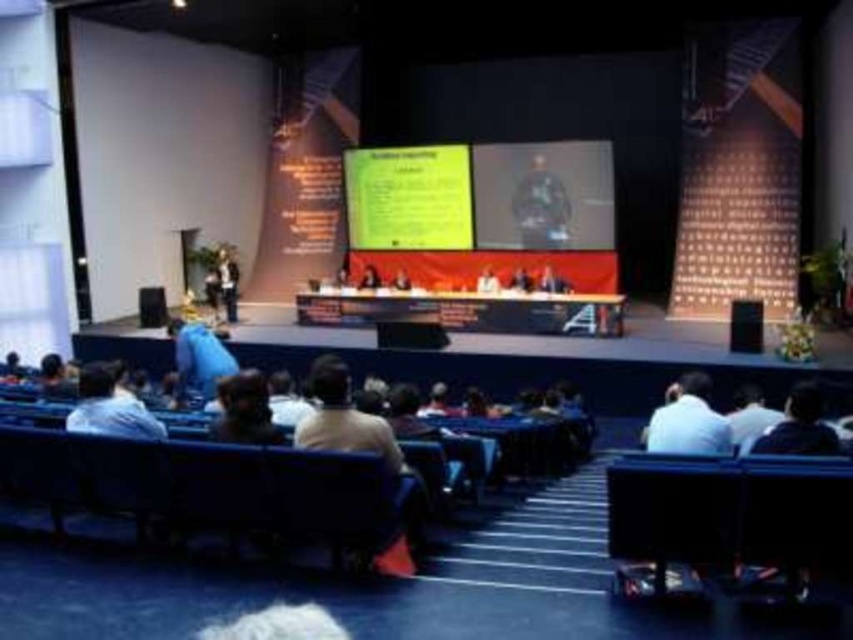
Looking at this image, you are standing at the back of the auditorium and want to move to the dark brown leather chair at lower right. The width of your wheelchair is 0.6 meters. Is there enough space to move freely to the chair?

The distance between you and the dark brown leather chair at lower right is 4.99 meters. Since the path width isn generated from the description, but the distance is sufficient, you can move freely to the chair as long as there are no obstacles in between.

What is the location of the yellow paper at upper center in the image?

The yellow paper at upper center is located at point (408, 196).

You are an attendee in the auditorium and you want to take a photo of the yellow paper at upper center and the white fabric shirt at lower right. Which object should you focus on first if you want to capture both in a single frame without moving the camera?

The yellow paper at upper center is bigger than the white fabric shirt at lower right, so you should focus on the yellow paper at upper center first to ensure it is clearly visible in the frame, then adjust the composition to include the smaller white fabric shirt at lower right.